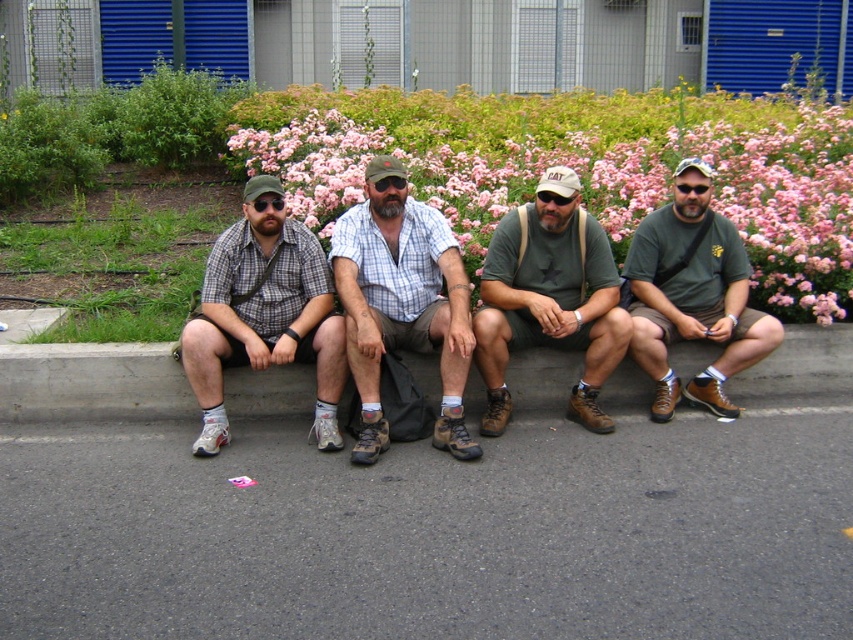
Question: Considering the real-world distances, which object is farthest from the green cotton shirt at center?

Choices:
 (A) plaid fabric shirt at center
 (B) plaid shirt at center
 (C) matte black goggles at center

Answer: (C)

Question: Is plaid fabric shirt at center wider than green cotton shirt at center?

Choices:
 (A) yes
 (B) no

Answer: (A)

Question: Among these objects, which one is farthest from the camera?

Choices:
 (A) plaid fabric shirt at center
 (B) green cotton shirt at center
 (C) green matte t-shirt at center
 (D) concrete at center

Answer: (D)

Question: Which point is closer to the camera?

Choices:
 (A) plaid fabric shirt at center
 (B) green cotton shirt at center
 (C) green matte t-shirt at center

Answer: (A)

Question: Where is green cotton shirt at center located in relation to green matte t-shirt at center in the image?

Choices:
 (A) below
 (B) above

Answer: (A)

Question: Is green cotton shirt at center positioned before matte black goggles at center?

Choices:
 (A) yes
 (B) no

Answer: (A)